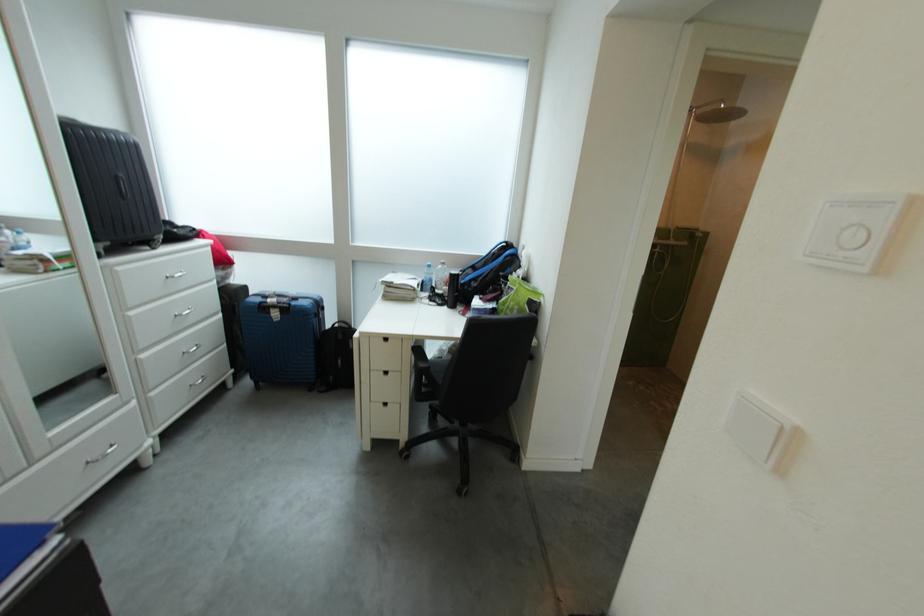
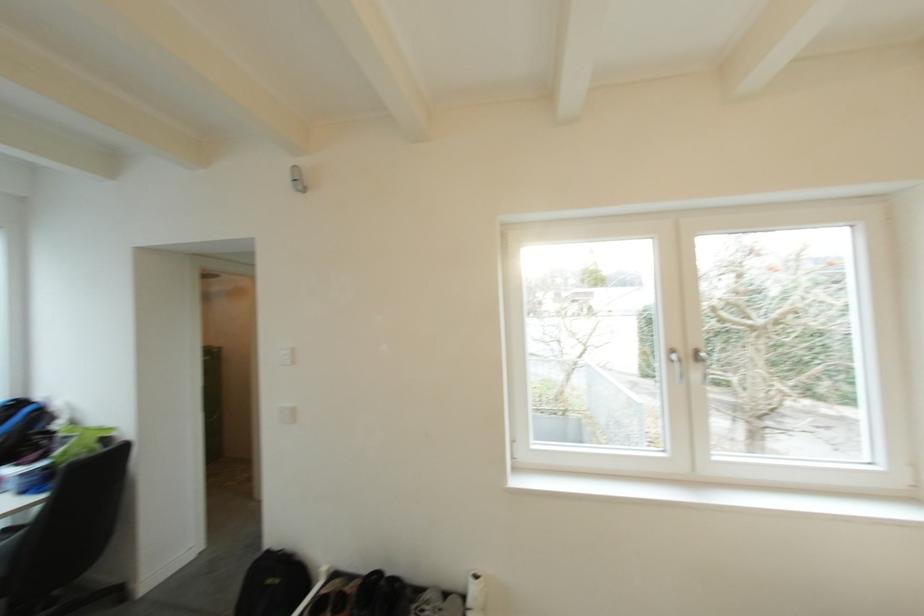
Locate, in the second image, the point that corresponds to pixel 517 246 in the first image.

(29, 403)